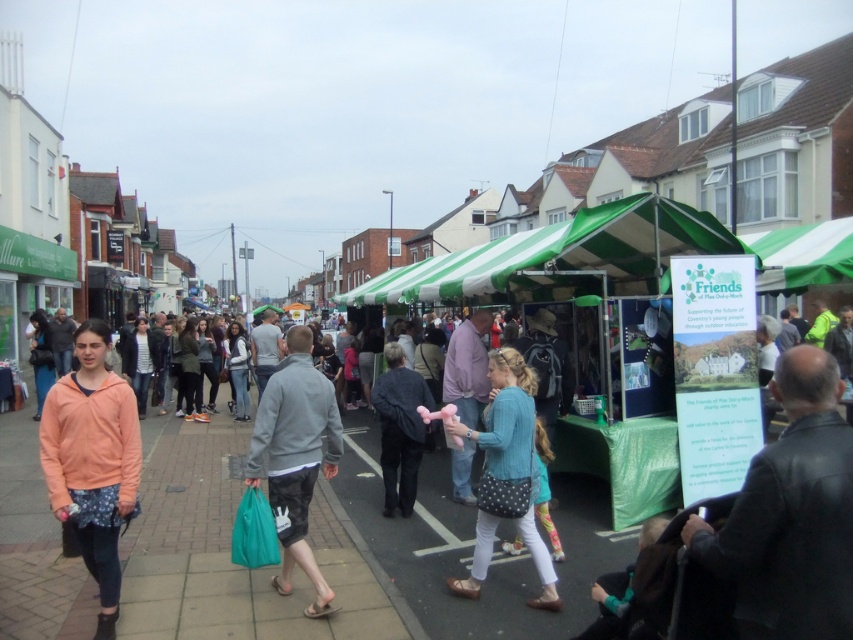
Question: Is the position of matte peach hoodie at center more distant than that of blue knitted sweater at center?

Choices:
 (A) no
 (B) yes

Answer: (A)

Question: Estimate the real-world distances between objects in this image. Which object is closer to the gray fabric jacket at center?

Choices:
 (A) blue knitted sweater at center
 (B) matte peach hoodie at center

Answer: (B)

Question: Based on their relative distances, which object is farther from the leather jacket at lower right?

Choices:
 (A) blue knitted sweater at center
 (B) dark gray textured jacket at center
 (C) matte peach hoodie at center
 (D) gray fabric jacket at center

Answer: (B)

Question: Is gray fabric jacket at center closer to camera compared to blue knitted sweater at center?

Choices:
 (A) no
 (B) yes

Answer: (B)

Question: Based on their relative distances, which object is nearer to the matte peach hoodie at center?

Choices:
 (A) leather jacket at lower right
 (B) gray fabric jacket at center
 (C) dark gray textured jacket at center

Answer: (B)

Question: Does blue knitted sweater at center have a smaller size compared to dark gray textured jacket at center?

Choices:
 (A) yes
 (B) no

Answer: (B)